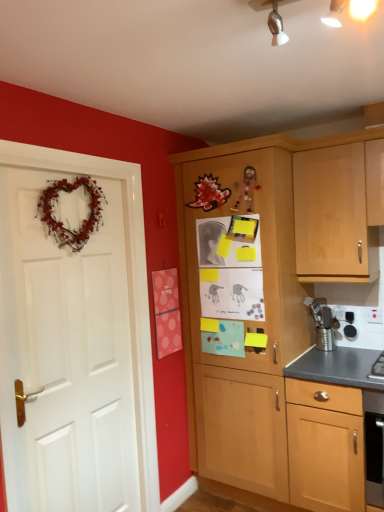
What is the approximate height of white matte door at left?

white matte door at left is 6.25 feet tall.

The height and width of the screenshot is (512, 384). Describe the element at coordinates (324, 338) in the screenshot. I see `metallic silver utensil holder at right` at that location.

Where is `pink polka dot postcard at center`? pink polka dot postcard at center is located at coordinates (x=167, y=312).

Identify the location of white matte door at left. (65, 357).

Consider the image. Is pink polka dot postcard at center oriented away from wooden cabinet at center?

pink polka dot postcard at center is not turned away from wooden cabinet at center.

From the image's perspective, relative to wooden cabinet at center, is pink polka dot postcard at center above or below?

From the image's perspective, pink polka dot postcard at center appears above wooden cabinet at center.

Considering the sizes of pink polka dot postcard at center and wooden cabinet at center in the image, is pink polka dot postcard at center bigger or smaller than wooden cabinet at center?

Clearly, pink polka dot postcard at center is smaller in size than wooden cabinet at center.

Would you say wooden cabinet at center is to the left or to the right of pink polka dot postcard at center in the picture?

Clearly, wooden cabinet at center is on the right of pink polka dot postcard at center in the image.

Is wooden cabinet at center touching pink polka dot postcard at center?

No, wooden cabinet at center is not beside pink polka dot postcard at center.

Is wooden cabinet at center taller than pink polka dot postcard at center?

Indeed, wooden cabinet at center has a greater height compared to pink polka dot postcard at center.

From a real-world perspective, is metallic silver utensil holder at right above or below wooden cabinet at center?

metallic silver utensil holder at right is situated lower than wooden cabinet at center in the real world.

Which point is more distant from viewer, (321, 338) or (242, 384)?

The point (321, 338) is farther from the camera.

Considering the positions of objects metallic silver utensil holder at right and wooden cabinet at center in the image provided, who is in front, metallic silver utensil holder at right or wooden cabinet at center?

wooden cabinet at center.

The image size is (384, 512). What are the coordinates of `appliance behind the wooden cabinet at center` in the screenshot? It's located at (324, 338).

From a real-world perspective, is white matte door at left beneath pink polka dot postcard at center?

Correct, in the physical world, white matte door at left is lower than pink polka dot postcard at center.

Is white matte door at left looking in the opposite direction of pink polka dot postcard at center?

white matte door at left does not have its back to pink polka dot postcard at center.

Looking at this image, does white matte door at left have a greater width compared to pink polka dot postcard at center?

Yes.

Is wooden cabinet at center at the left side of white matte door at left?

In fact, wooden cabinet at center is to the right of white matte door at left.

What are the coordinates of `door below the wooden cabinet at center (from the image's perspective)` in the screenshot? It's located at (65, 357).

Is wooden cabinet at center facing away from white matte door at left?

That's not correct — wooden cabinet at center is not looking away from white matte door at left.

Is wooden cabinet at center spatially inside white matte door at left, or outside of it?

wooden cabinet at center is located beyond the bounds of white matte door at left.

Looking at their sizes, would you say white matte door at left is wider or thinner than metallic silver utensil holder at right?

Clearly, white matte door at left has less width compared to metallic silver utensil holder at right.

Considering the relative positions of white matte door at left and metallic silver utensil holder at right in the image provided, is white matte door at left behind metallic silver utensil holder at right?

No, the depth of white matte door at left is less than that of metallic silver utensil holder at right.

From a real-world perspective, is white matte door at left over metallic silver utensil holder at right?

Yes.

Is white matte door at left not inside metallic silver utensil holder at right?

That's correct, white matte door at left is outside of metallic silver utensil holder at right.

Between pink polka dot postcard at center and white matte door at left, which one has less height?

With less height is pink polka dot postcard at center.

Is point (162, 282) closer or farther from the camera than point (116, 470)?

Clearly, point (162, 282) is more distant from the camera than point (116, 470).

Is pink polka dot postcard at center bigger or smaller than white matte door at left?

In the image, pink polka dot postcard at center appears to be smaller than white matte door at left.

Locate an element on the screen. This screenshot has width=384, height=512. postcard above the wooden cabinet at center (from the image's perspective) is located at coordinates (167, 312).

The height and width of the screenshot is (512, 384). In order to click on postcard above the wooden cabinet at center (from a real-world perspective) in this screenshot , I will do `click(167, 312)`.

Which object lies nearer to the anchor point metallic silver utensil holder at right, white matte door at left or pink polka dot postcard at center?

pink polka dot postcard at center is closer to metallic silver utensil holder at right.

Based on their spatial positions, is white matte door at left or metallic silver utensil holder at right further from wooden cabinet at center?

white matte door at left lies further to wooden cabinet at center than the other object.

Which object lies further to the anchor point wooden cabinet at center, metallic silver utensil holder at right or pink polka dot postcard at center?

metallic silver utensil holder at right lies further to wooden cabinet at center than the other object.

Which object lies nearer to the anchor point white matte door at left, pink polka dot postcard at center or wooden cabinet at center?

pink polka dot postcard at center is positioned closer to the anchor white matte door at left.

Estimate the real-world distances between objects in this image. Which object is closer to pink polka dot postcard at center, metallic silver utensil holder at right or white matte door at left?

The object closer to pink polka dot postcard at center is white matte door at left.

When comparing their distances from pink polka dot postcard at center, does wooden cabinet at center or white matte door at left seem further?

white matte door at left.

Considering their positions, is pink polka dot postcard at center positioned closer to wooden cabinet at center than metallic silver utensil holder at right?

pink polka dot postcard at center is positioned closer to the anchor wooden cabinet at center.

From the image, which object appears to be nearer to white matte door at left, metallic silver utensil holder at right or wooden cabinet at center?

Among the two, wooden cabinet at center is located nearer to white matte door at left.

The width and height of the screenshot is (384, 512). What are the coordinates of `postcard between white matte door at left and wooden cabinet at center in the horizontal direction` in the screenshot? It's located at (167, 312).

Find the location of a particular element. cabinetry between pink polka dot postcard at center and metallic silver utensil holder at right in the horizontal direction is located at coordinates (274, 309).

Find the location of a particular element. This screenshot has width=384, height=512. postcard located between white matte door at left and metallic silver utensil holder at right in the left-right direction is located at coordinates (167, 312).

The width and height of the screenshot is (384, 512). Identify the location of cabinetry situated between white matte door at left and metallic silver utensil holder at right from left to right. (274, 309).